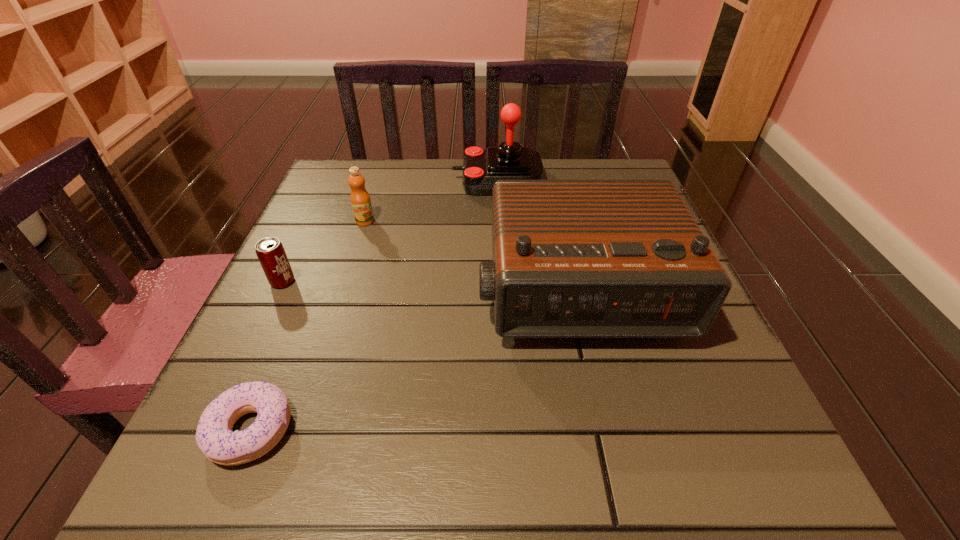
Where is `unoccupied position between the shortest object and the beer can`? This screenshot has width=960, height=540. unoccupied position between the shortest object and the beer can is located at coordinates (267, 356).

Locate an element on the screen. The height and width of the screenshot is (540, 960). free space that is in between the shortest object and the radio receiver is located at coordinates (414, 361).

At what (x,y) coordinates should I click in order to perform the action: click on free spot between the second shortest object and the second farthest object. Please return your answer as a coordinate pair (x, y). The width and height of the screenshot is (960, 540). Looking at the image, I should click on (324, 252).

This screenshot has width=960, height=540. What are the coordinates of `vacant space that is in between the fourth nearest object and the second shortest object` in the screenshot? It's located at (324, 252).

You are a GUI agent. You are given a task and a screenshot of the screen. Output one action in this format:
    pyautogui.click(x=<x>, y=<y>)
    Task: Click on the free spot between the nearest object and the third tallest object
    
    Given the screenshot: What is the action you would take?
    pyautogui.click(x=308, y=326)

Where is `free spot between the fourth tallest object and the second farthest object`? Image resolution: width=960 pixels, height=540 pixels. free spot between the fourth tallest object and the second farthest object is located at coordinates (324, 252).

I want to click on free space between the farthest object and the beer can, so click(391, 231).

This screenshot has height=540, width=960. I want to click on unoccupied area between the radio receiver and the shortest object, so click(x=414, y=361).

Locate which object is the closest to the farthest object. Please provide its 2D coordinates. Your answer should be formatted as a tuple, i.e. [(x, y)], where the tuple contains the x and y coordinates of a point satisfying the conditions above.

[(571, 258)]

Locate which object is the fourth closest to the nearest object. Please provide its 2D coordinates. Your answer should be formatted as a tuple, i.e. [(x, y)], where the tuple contains the x and y coordinates of a point satisfying the conditions above.

[(481, 168)]